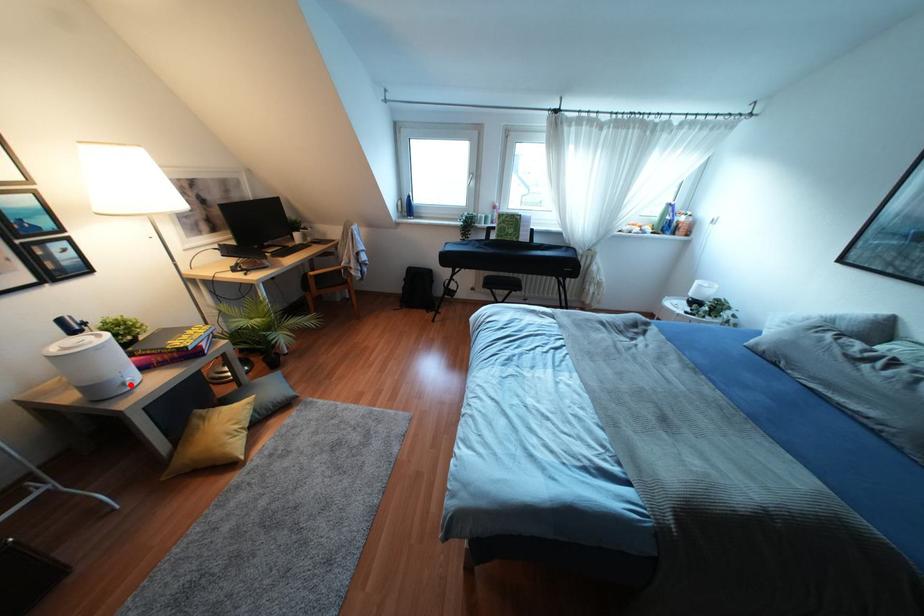
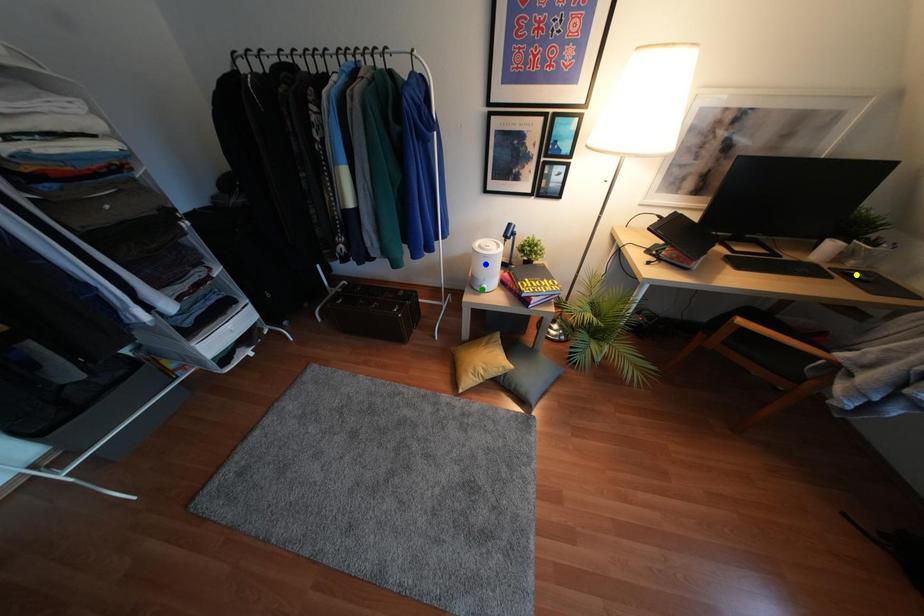
Question: I am providing you with two images of the same scene from different viewpoints. A red point is marked on the first image. You are given multiple points on the second image. Which point in image 2 represents the same 3d spot as the red point in image 1?

Choices:
 (A) blue point
 (B) yellow point
 (C) green point

Answer: (C)